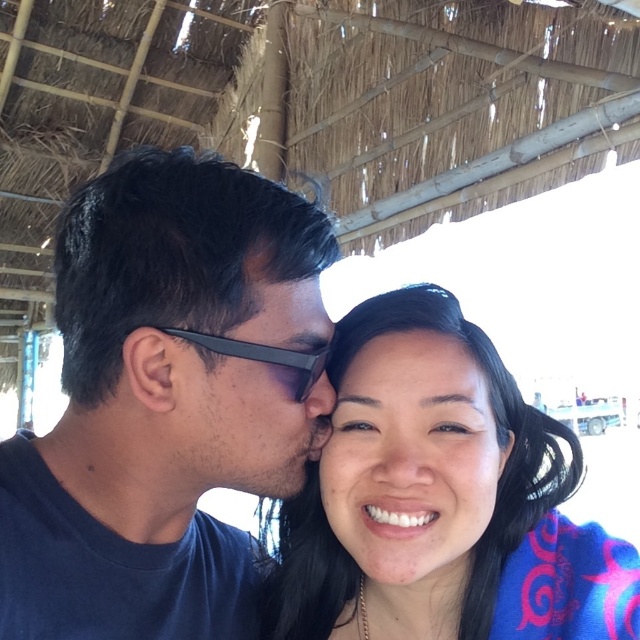
Between point (401, 544) and point (275, 474), which one is positioned in front?

Point (401, 544) is in front.

Is smooth skin face at center in front of matte black sunglasses at center?

No.

Who is more forward, [378,497] or [284,452]?

Point [378,497] is in front.

At what (x,y) coordinates should I click in order to perform the action: click on smooth skin face at center. Please return your answer as a coordinate pair (x, y). Image resolution: width=640 pixels, height=640 pixels. Looking at the image, I should click on (412, 460).

Does dark blue shirt at left come in front of matte black hair at center?

Yes, it is in front of matte black hair at center.

Does dark blue shirt at left appear on the left side of matte black hair at center?

Yes, dark blue shirt at left is to the left of matte black hair at center.

Is point (275, 348) farther from viewer compared to point (396, 579)?

That is False.

Locate an element on the screen. This screenshot has width=640, height=640. dark blue shirt at left is located at coordinates tap(164, 401).

Which is in front, point (92, 592) or point (413, 355)?

Point (413, 355) is more forward.

The width and height of the screenshot is (640, 640). What are the coordinates of `dark blue shirt at left` in the screenshot? It's located at (164, 401).

At what (x,y) coordinates should I click in order to perform the action: click on dark blue shirt at left. Please return your answer as a coordinate pair (x, y). This screenshot has width=640, height=640. Looking at the image, I should click on (164, 401).